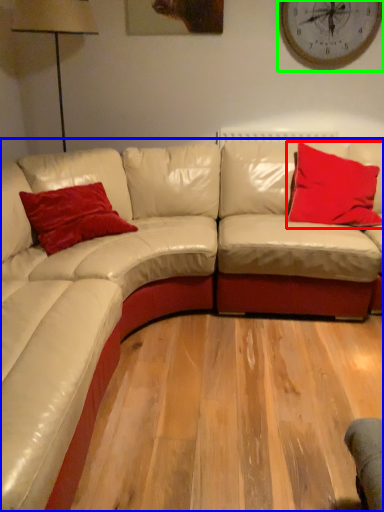
Question: Based on their relative distances, which object is nearer to pillow (highlighted by a red box)? Choose from studio couch (highlighted by a blue box) and clock (highlighted by a green box).

Choices:
 (A) studio couch
 (B) clock

Answer: (A)